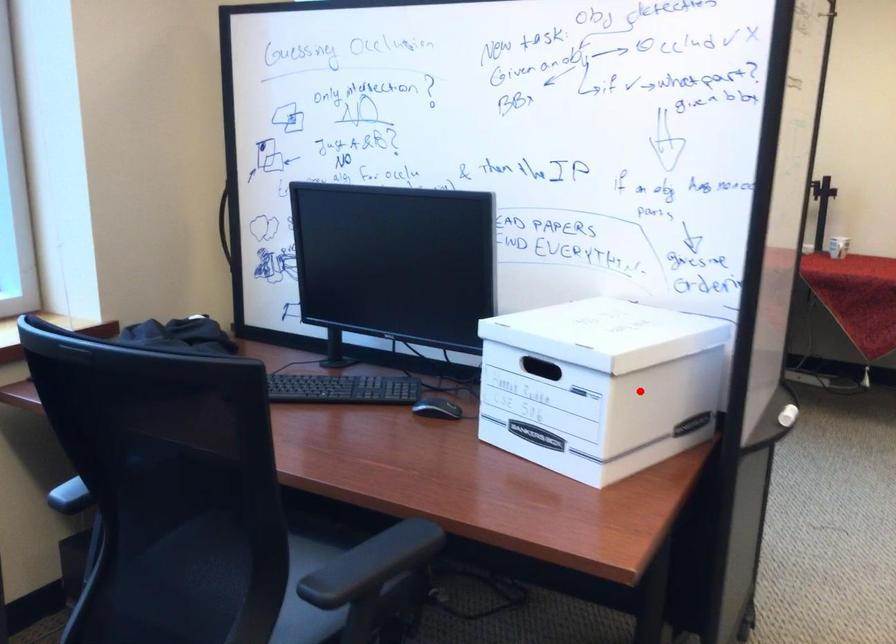
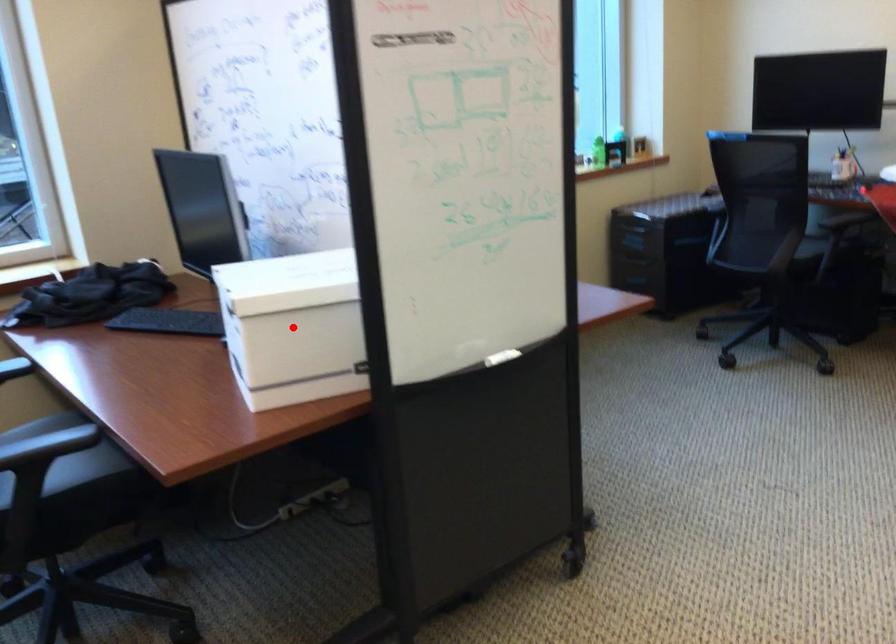
I am providing you with two images of the same scene from different viewpoints. A red point is marked on the first image and another point is marked on the second image. Is the red point in image1 aligned with the point shown in image2?

Yes